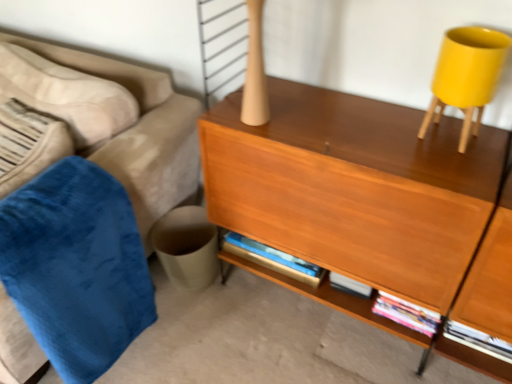
Question: In terms of width, does velvet blue couch at left look wider or thinner when compared to matte yellow plastic swivel chair at upper right?

Choices:
 (A) wide
 (B) thin

Answer: (A)

Question: Looking at the image, does velvet blue couch at left seem bigger or smaller compared to matte yellow plastic swivel chair at upper right?

Choices:
 (A) big
 (B) small

Answer: (A)

Question: Which is farther from the velvet blue couch at left?

Choices:
 (A) wooden desk at center
 (B) velvet blue blanket at left
 (C) matte yellow plastic swivel chair at upper right

Answer: (C)

Question: Estimate the real-world distances between objects in this image. Which object is closer to the wooden desk at center?

Choices:
 (A) matte yellow plastic swivel chair at upper right
 (B) velvet blue couch at left
 (C) velvet blue blanket at left

Answer: (A)